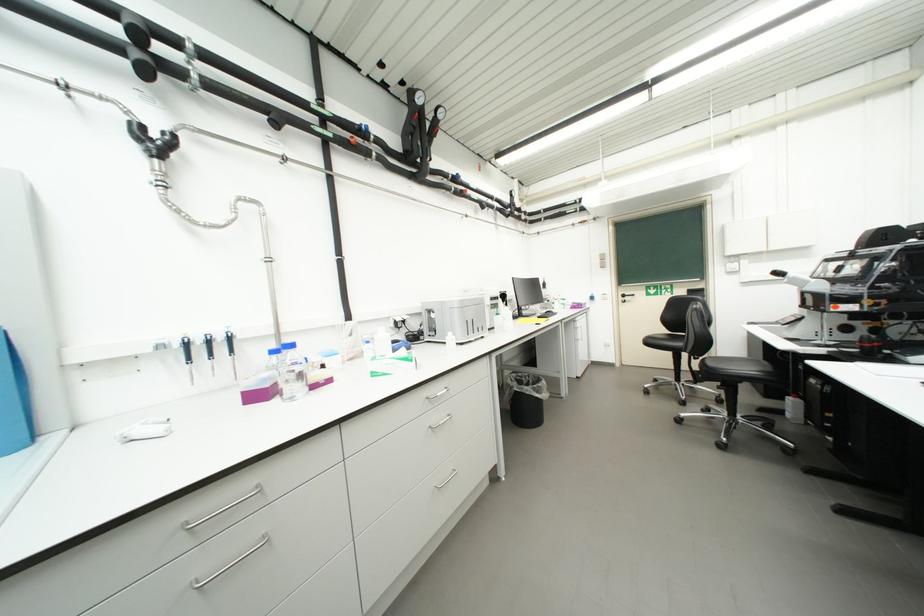
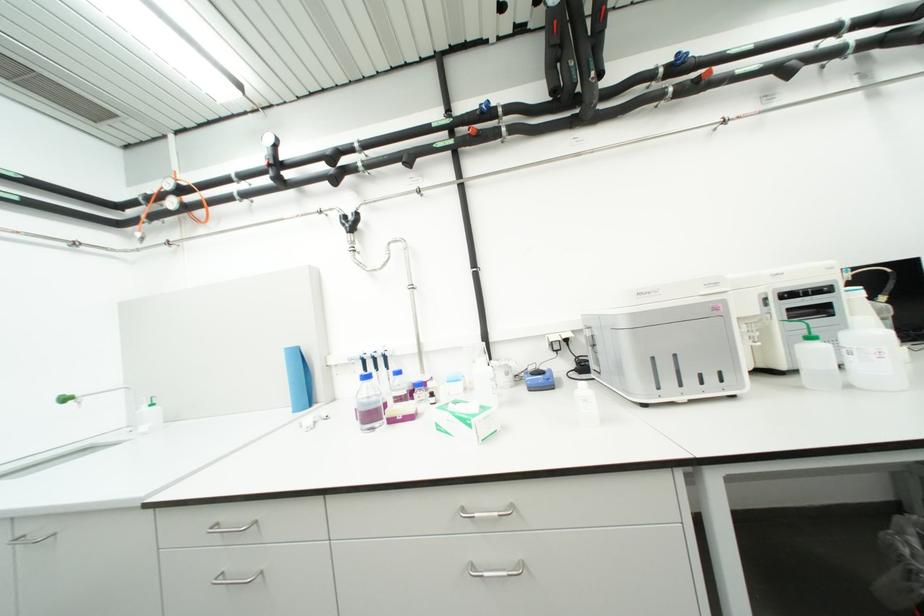
The point at (446, 395) is marked in the first image. Where is the corresponding point in the second image?

(484, 516)